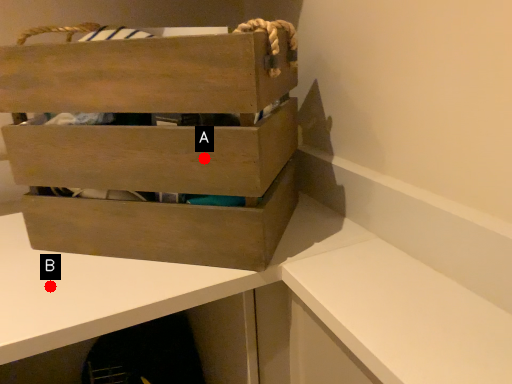
Question: Two points are circled on the image, labeled by A and B beside each circle. Which point is farther from the camera taking this photo?

Choices:
 (A) A is further
 (B) B is further

Answer: (B)